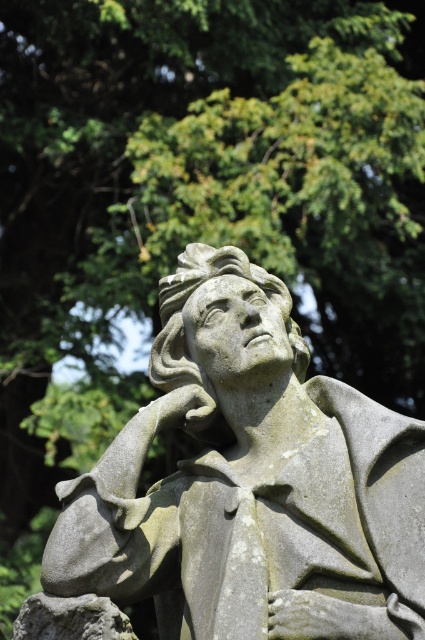
In the scene shown: You are an art conservator assessing the space in front of the two statues. The gray stone statue at center and the gray stone statue at lower left are both in need of protective barriers. If the barriers must be placed around each statue without overlapping, which statue requires a wider barrier based on their sizes?

The gray stone statue at center requires a wider barrier because its width is larger than the gray stone statue at lower left.

You are standing in front of the gray stone statue at lower left and want to move to the gray stone statue at center. In which direction should you walk?

You should walk to the right to reach the gray stone statue at center from the gray stone statue at lower left.